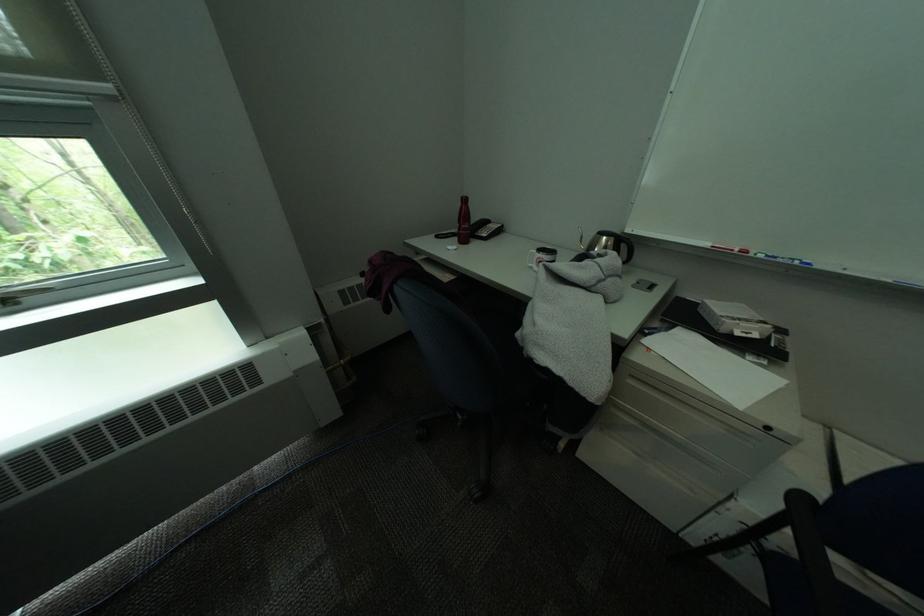
Where would you resting arm the chair armrest? Please return your answer as a coordinate pair (x, y).

(808, 538)